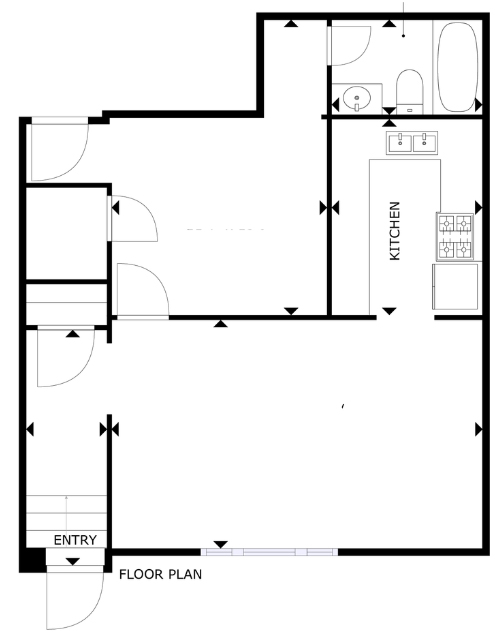
Image resolution: width=500 pixels, height=642 pixels. Identify the location of archway. (399, 317).